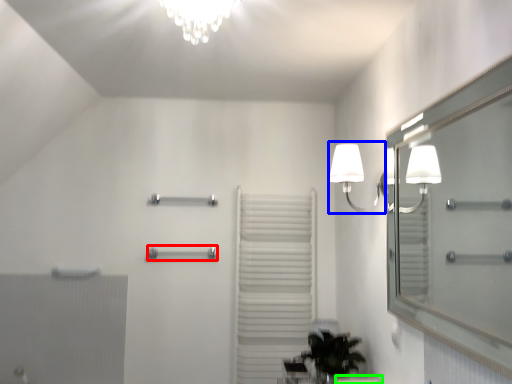
Question: Estimate the real-world distances between objects in this image. Which object is farther from towel bar (highlighted by a red box), lamp (highlighted by a blue box) or counter top (highlighted by a green box)?

Choices:
 (A) lamp
 (B) counter top

Answer: (B)